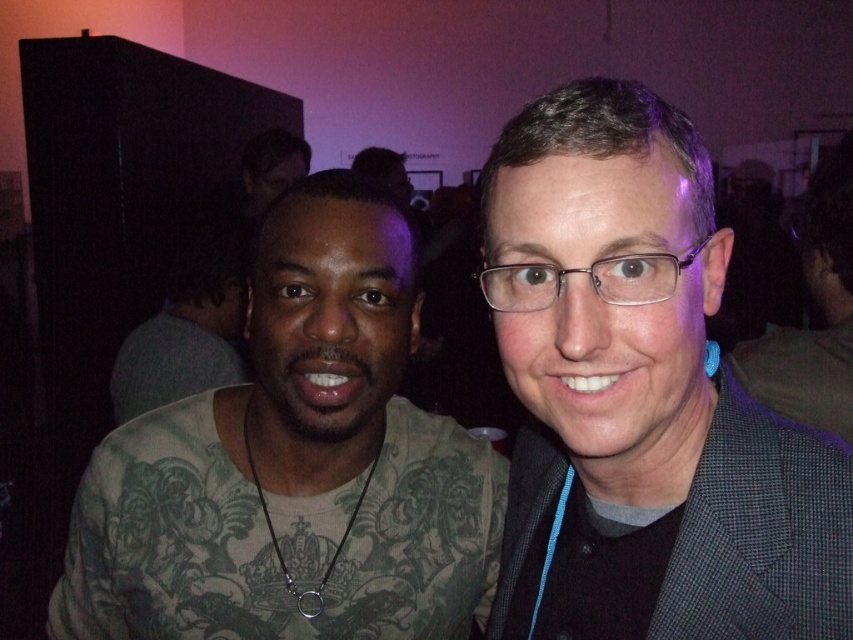
Who is positioned more to the right, green tattooed shirt at left or gray checkered suit at center?

Positioned to the right is gray checkered suit at center.

Does point (79, 529) lie behind point (798, 358)?

No, (79, 529) is closer to viewer.

Which is behind, point (289, 636) or point (811, 371)?

The point (811, 371) is behind.

Where is `green tattooed shirt at left`? This screenshot has width=853, height=640. green tattooed shirt at left is located at coordinates (294, 465).

Between gray checkered blazer at right and green tattooed shirt at center, which one is positioned lower?

gray checkered blazer at right

In the scene shown: Measure the distance between gray checkered blazer at right and camera.

gray checkered blazer at right and camera are 17.56 inches apart.

Describe the element at coordinates (641, 397) in the screenshot. This screenshot has width=853, height=640. I see `gray checkered blazer at right` at that location.

Find the location of a particular element. gray checkered blazer at right is located at coordinates pos(641,397).

Who is more forward, [790,604] or [830,289]?

Positioned in front is point [790,604].

Who is higher up, gray checkered blazer at right or gray checkered suit at center?

gray checkered suit at center

Locate an element on the screen. gray checkered blazer at right is located at coordinates (641, 397).

This screenshot has height=640, width=853. What are the coordinates of `gray checkered blazer at right` in the screenshot? It's located at (641, 397).